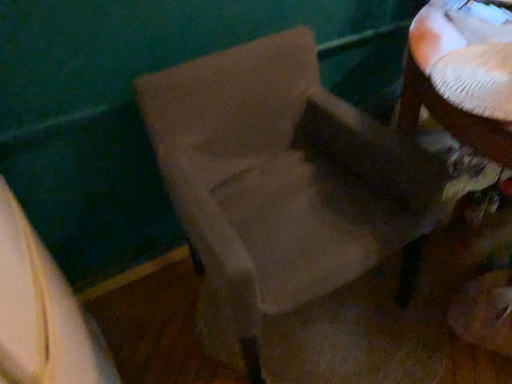
Question: From a real-world perspective, is white textured table at upper right below white fabric at lower left?

Choices:
 (A) no
 (B) yes

Answer: (A)

Question: Is white textured table at upper right to the left of white fabric at lower left from the viewer's perspective?

Choices:
 (A) no
 (B) yes

Answer: (A)

Question: Could you tell me if white textured table at upper right is turned towards white fabric at lower left?

Choices:
 (A) no
 (B) yes

Answer: (A)

Question: Does white textured table at upper right appear on the right side of white fabric at lower left?

Choices:
 (A) no
 (B) yes

Answer: (B)

Question: Does white textured table at upper right come in front of white fabric at lower left?

Choices:
 (A) yes
 (B) no

Answer: (B)

Question: Could white fabric at lower left be considered to be inside white textured table at upper right?

Choices:
 (A) yes
 (B) no

Answer: (B)

Question: From a real-world perspective, is white fabric at lower left physically below suede-like beige chair at center?

Choices:
 (A) no
 (B) yes

Answer: (A)

Question: Is white fabric at lower left not inside suede-like beige chair at center?

Choices:
 (A) no
 (B) yes

Answer: (B)

Question: Is white fabric at lower left to the left of suede-like beige chair at center from the viewer's perspective?

Choices:
 (A) no
 (B) yes

Answer: (B)

Question: Does white fabric at lower left turn towards suede-like beige chair at center?

Choices:
 (A) no
 (B) yes

Answer: (B)

Question: Considering the relative sizes of white fabric at lower left and suede-like beige chair at center in the image provided, is white fabric at lower left taller than suede-like beige chair at center?

Choices:
 (A) no
 (B) yes

Answer: (B)

Question: Does white fabric at lower left have a lesser width compared to suede-like beige chair at center?

Choices:
 (A) no
 (B) yes

Answer: (B)

Question: Is white fabric at lower left at the left side of white textured table at upper right?

Choices:
 (A) yes
 (B) no

Answer: (A)